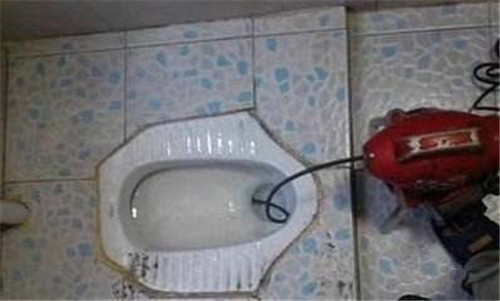
Where is `tiles`? This screenshot has height=301, width=500. tiles is located at coordinates (48, 118), (199, 78), (282, 74), (67, 238), (318, 283).